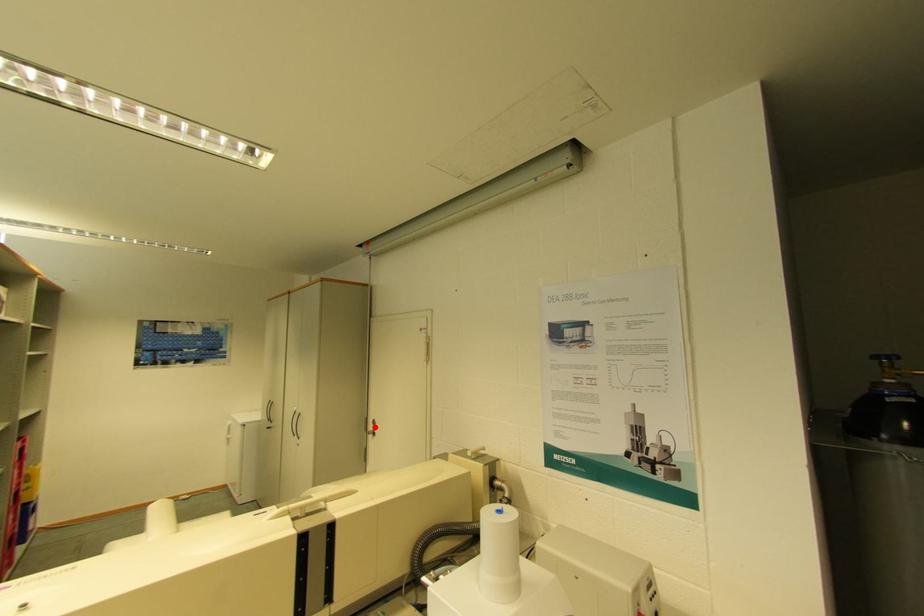
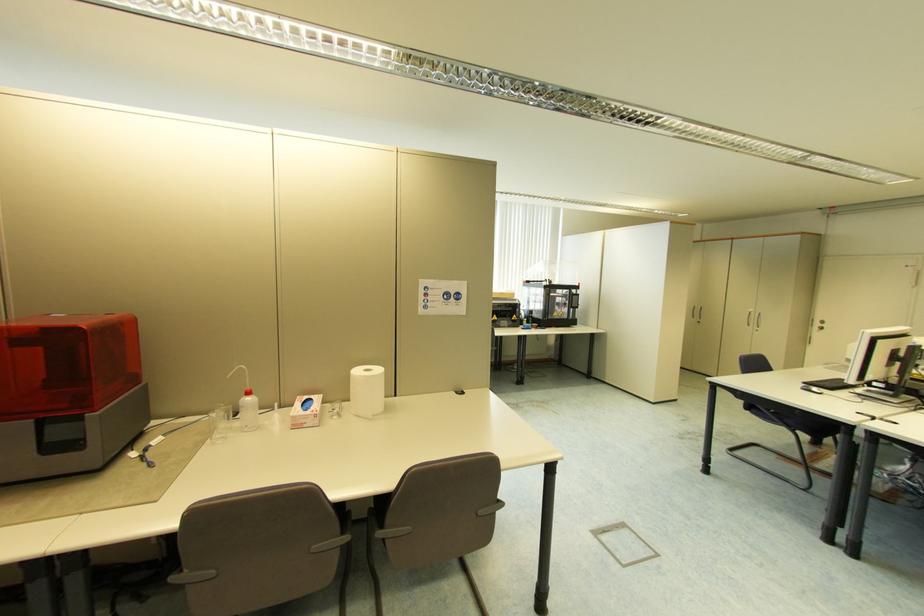
Question: I am providing you with two images of the same scene from different viewpoints. In image1, a red point is highlighted. Considering the same 3D point in image2, which of the following is correct?

Choices:
 (A) It is closer
 (B) It is farther

Answer: (B)